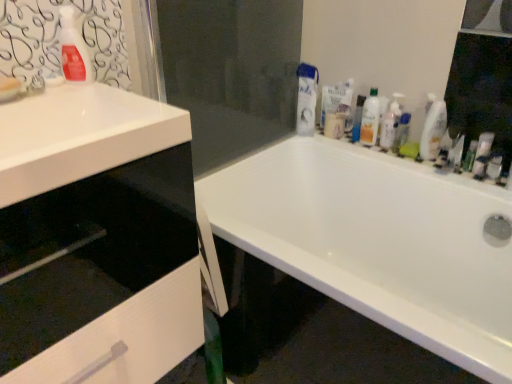
Question: Is white glossy bottle at upper right, marked as the 1th cleaning product in a right-to-left arrangement, with transparent glass screen door at center?

Choices:
 (A) no
 (B) yes

Answer: (A)

Question: Can you confirm if white glossy bottle at upper right, marked as the 1th cleaning product in a right-to-left arrangement, is smaller than transparent glass screen door at center?

Choices:
 (A) no
 (B) yes

Answer: (B)

Question: Can you confirm if white glossy bottle at upper right, marked as the 1th cleaning product in a right-to-left arrangement, is thinner than transparent glass screen door at center?

Choices:
 (A) no
 (B) yes

Answer: (B)

Question: Can you confirm if white glossy bottle at upper right, marked as the 1th cleaning product in a right-to-left arrangement, is bigger than transparent glass screen door at center?

Choices:
 (A) no
 (B) yes

Answer: (A)

Question: From a real-world perspective, is white glossy bottle at upper right, marked as the second cleaning product in a front-to-back arrangement, physically above transparent glass screen door at center?

Choices:
 (A) no
 (B) yes

Answer: (A)

Question: Is white glossy bottle at upper right, marked as the 1th cleaning product in a right-to-left arrangement, not near transparent glass screen door at center?

Choices:
 (A) yes
 (B) no

Answer: (B)

Question: Considering the relative sizes of matte plastic container at upper right, the first toiletry in the back-to-front sequence, and clear glass mirror at upper right in the image provided, is matte plastic container at upper right, the first toiletry in the back-to-front sequence, smaller than clear glass mirror at upper right?

Choices:
 (A) yes
 (B) no

Answer: (A)

Question: Is matte plastic container at upper right, the third toiletry when ordered from right to left, wider than clear glass mirror at upper right?

Choices:
 (A) yes
 (B) no

Answer: (A)

Question: Is matte plastic container at upper right, the third toiletry when ordered from right to left, aimed at clear glass mirror at upper right?

Choices:
 (A) no
 (B) yes

Answer: (A)

Question: Is matte plastic container at upper right, the first toiletry in the back-to-front sequence, thinner than clear glass mirror at upper right?

Choices:
 (A) no
 (B) yes

Answer: (A)

Question: Can you see matte plastic container at upper right, arranged as the first toiletry when viewed from the left, touching clear glass mirror at upper right?

Choices:
 (A) yes
 (B) no

Answer: (B)

Question: Can you confirm if matte plastic container at upper right, the first toiletry in the back-to-front sequence, is shorter than clear glass mirror at upper right?

Choices:
 (A) no
 (B) yes

Answer: (B)

Question: Does clear glass mirror at upper right appear on the left side of green matte tube at right, positioned as the second toiletry in back-to-front order?

Choices:
 (A) yes
 (B) no

Answer: (B)